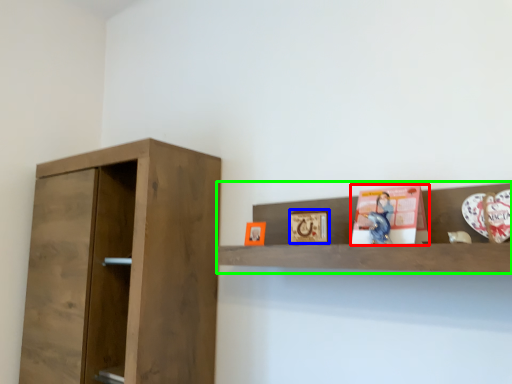
Question: Which is farther away from book (highlighted by a red box)? picture frame (highlighted by a blue box) or shelf (highlighted by a green box)?

Choices:
 (A) picture frame
 (B) shelf

Answer: (A)